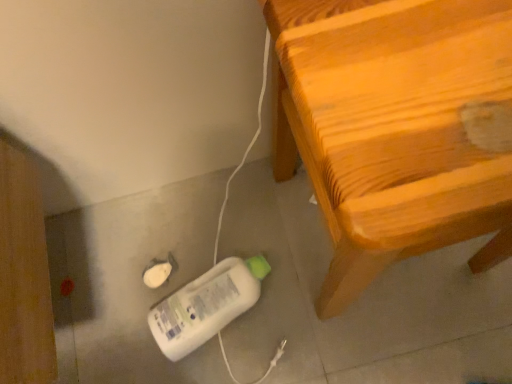
Question: Does wooden chair at right come behind white plastic bottle at lower center?

Choices:
 (A) yes
 (B) no

Answer: (B)

Question: Is wooden chair at right at the right side of white plastic bottle at lower center?

Choices:
 (A) no
 (B) yes

Answer: (B)

Question: From the image's perspective, is wooden chair at right located beneath white plastic bottle at lower center?

Choices:
 (A) yes
 (B) no

Answer: (B)

Question: From a real-world perspective, is wooden chair at right located beneath white plastic bottle at lower center?

Choices:
 (A) no
 (B) yes

Answer: (A)

Question: From the image's perspective, is wooden chair at right above white plastic bottle at lower center?

Choices:
 (A) no
 (B) yes

Answer: (B)

Question: Is wooden chair at right aimed at white plastic bottle at lower center?

Choices:
 (A) yes
 (B) no

Answer: (B)

Question: Could you tell me if white plastic bottle at lower center is turned towards wooden chair at right?

Choices:
 (A) yes
 (B) no

Answer: (B)

Question: Considering the relative positions of white plastic bottle at lower center and wooden chair at right in the image provided, is white plastic bottle at lower center to the right of wooden chair at right from the viewer's perspective?

Choices:
 (A) yes
 (B) no

Answer: (B)

Question: Considering the relative sizes of white plastic bottle at lower center and wooden chair at right in the image provided, is white plastic bottle at lower center taller than wooden chair at right?

Choices:
 (A) yes
 (B) no

Answer: (B)

Question: From the image's perspective, is white plastic bottle at lower center over wooden chair at right?

Choices:
 (A) no
 (B) yes

Answer: (A)

Question: From a real-world perspective, is white plastic bottle at lower center on top of wooden chair at right?

Choices:
 (A) no
 (B) yes

Answer: (A)

Question: Does white plastic bottle at lower center have a greater width compared to wooden chair at right?

Choices:
 (A) no
 (B) yes

Answer: (A)

Question: Do you think wooden chair at right is within white plastic bottle at lower center, or outside of it?

Choices:
 (A) outside
 (B) inside

Answer: (A)